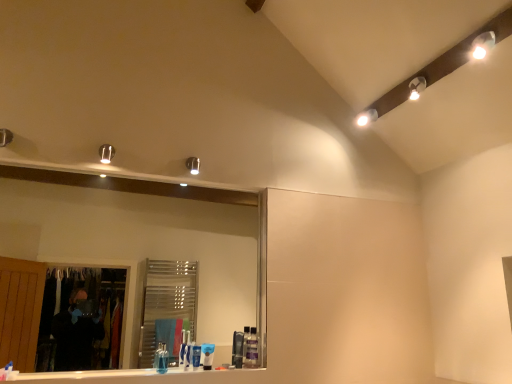
Identify the location of free space between blue matte toothpaste at center, placed as the third toiletry when sorted from right to left, and blue glossy toothpaste tube at lower center, which ranks as the first toiletry in left-to-right order. Image resolution: width=512 pixels, height=384 pixels. (179, 375).